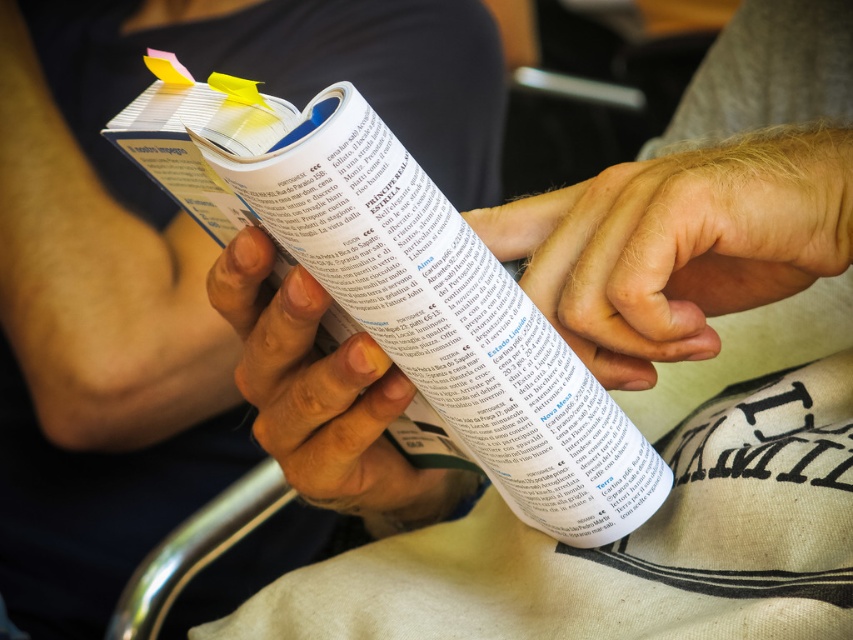
Does matte paper book at center have a greater height compared to light skin tone flesh at center?

Yes, matte paper book at center is taller than light skin tone flesh at center.

In the scene shown: Who is more distant from viewer, [105,273] or [560,225]?

Point [105,273]

Find the location of `matte paper book at center`. matte paper book at center is located at coordinates (260, 90).

Does point (582, 289) come closer to viewer compared to point (351, 456)?

Yes, point (582, 289) is in front of point (351, 456).

Does point (779, 163) lie behind point (338, 378)?

No, (779, 163) is closer to viewer.

Which is in front, point (654, 170) or point (364, 436)?

Point (654, 170) is in front.

The image size is (853, 640). I want to click on light skin tone flesh at center, so click(677, 244).

Can you confirm if matte paper book at center is positioned to the right of smooth skin hand at center?

In fact, matte paper book at center is to the left of smooth skin hand at center.

Does matte paper book at center have a lesser height compared to smooth skin hand at center?

No.

Does point (10, 532) lie behind point (273, 448)?

That is True.

Locate an element on the screen. The width and height of the screenshot is (853, 640). matte paper book at center is located at coordinates (260, 90).